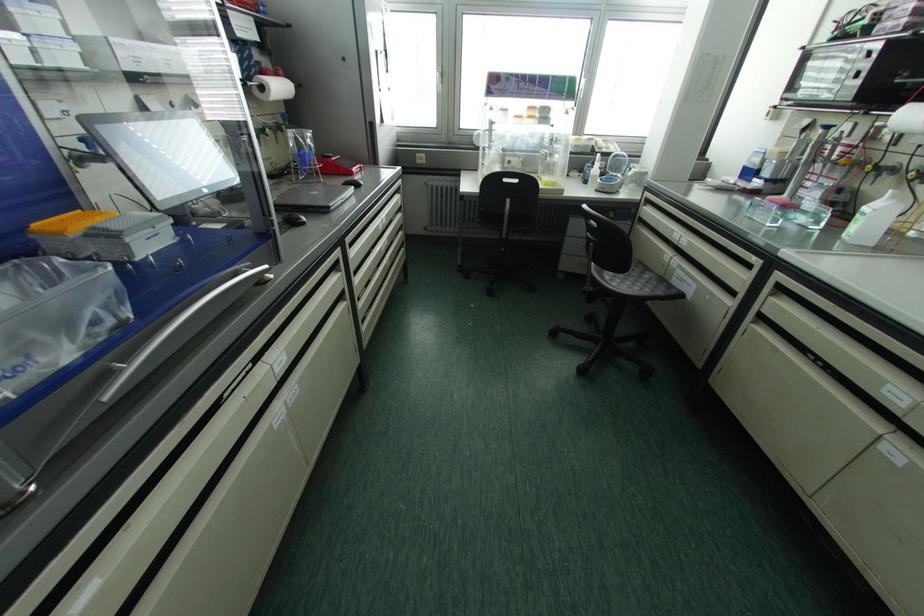
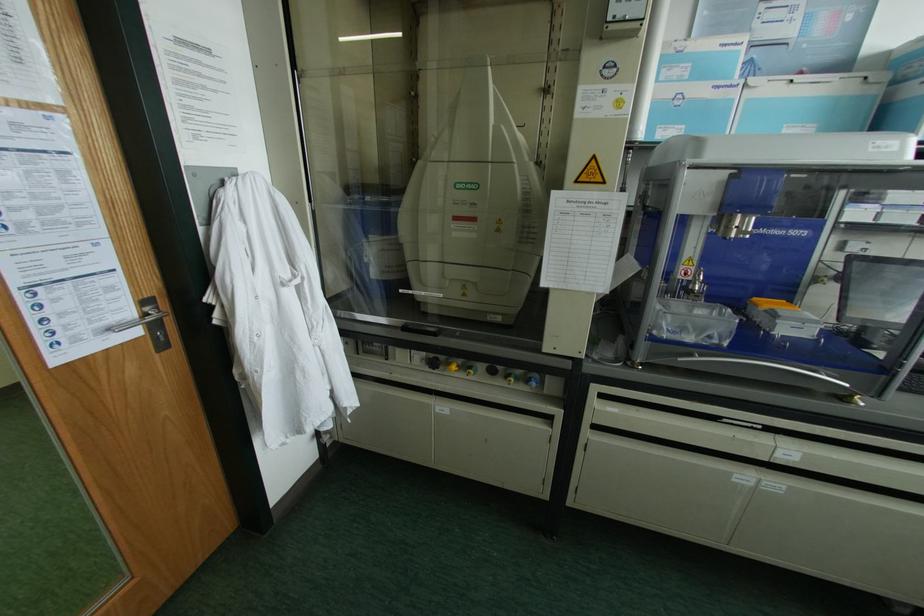
Where in the second image is the point corresponding to the point at 93,228 from the first image?

(772, 310)